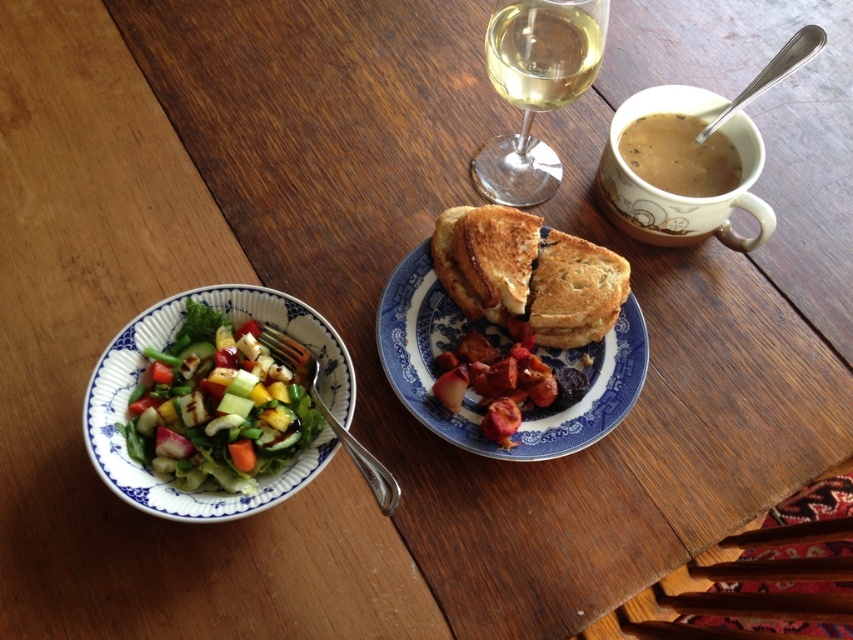
Question: Can you confirm if brown matte mug at upper right is wider than clear glass wine at upper center?

Choices:
 (A) yes
 (B) no

Answer: (A)

Question: Does fresh green salad at left have a larger size compared to clear glass wine at upper center?

Choices:
 (A) no
 (B) yes

Answer: (B)

Question: Does fresh green salad at left appear on the left side of clear glass wine at upper center?

Choices:
 (A) yes
 (B) no

Answer: (A)

Question: Which point is closer to the camera taking this photo?

Choices:
 (A) (509, 56)
 (B) (595, 280)
 (C) (593, 19)
 (D) (724, 186)

Answer: (C)

Question: Which is nearer to the toasted bread at center?

Choices:
 (A) brown toasted sandwich at center
 (B) brown matte cup at upper right
 (C) fresh green salad at left
 (D) brown matte mug at upper right

Answer: (A)

Question: Considering the real-world distances, which object is closest to the brown matte cup at upper right?

Choices:
 (A) brown toasted sandwich at center
 (B) brown matte mug at upper right
 (C) clear glass wine at upper center

Answer: (B)